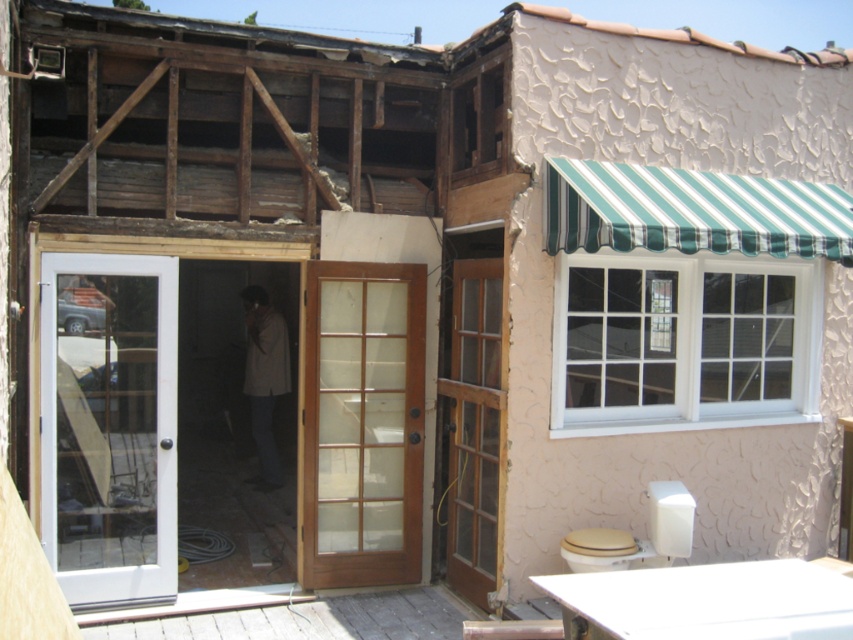
Question: Does white glass door at left come behind light brown fabric jacket at center?

Choices:
 (A) no
 (B) yes

Answer: (A)

Question: Among these points, which one is nearest to the camera?

Choices:
 (A) (285, 340)
 (B) (115, 465)
 (C) (364, 268)
 (D) (460, 269)

Answer: (B)

Question: Can you confirm if white glass door at left is bigger than mahogany wood french door at center?

Choices:
 (A) yes
 (B) no

Answer: (A)

Question: Which of these objects is positioned closest to the brown wooden door at center?

Choices:
 (A) mahogany wood french door at center
 (B) light brown fabric jacket at center

Answer: (A)

Question: Which object is the closest to the mahogany wood french door at center?

Choices:
 (A) brown wooden door at center
 (B) light brown fabric jacket at center
 (C) white glass door at left

Answer: (A)

Question: Is white glass door at left to the right of brown wooden door at center from the viewer's perspective?

Choices:
 (A) yes
 (B) no

Answer: (B)